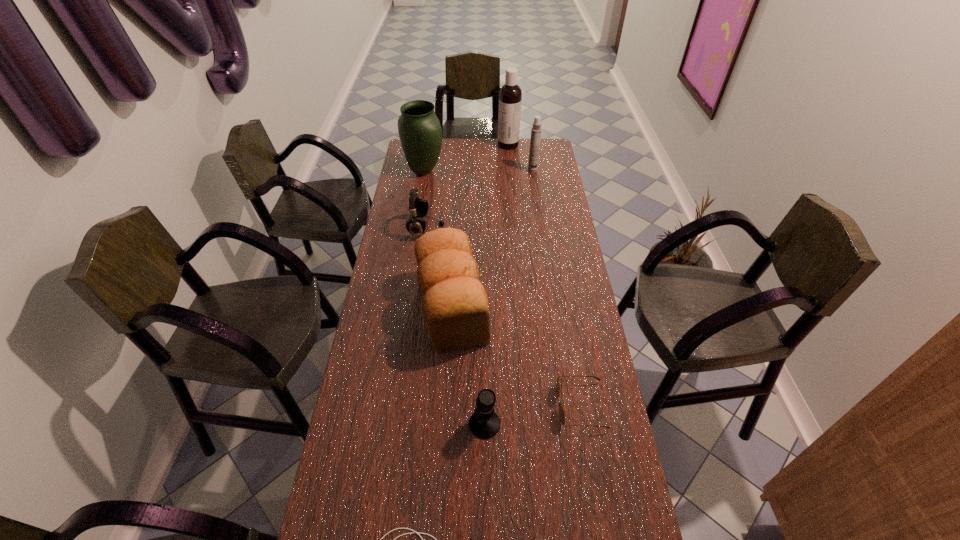
Identify the location of vase positioned at the far edge. (419, 129).

This screenshot has width=960, height=540. What are the coordinates of `vase positioned at the left edge` in the screenshot? It's located at (419, 129).

Where is `bread that is at the left edge`? This screenshot has height=540, width=960. bread that is at the left edge is located at coordinates (455, 304).

The image size is (960, 540). Find the location of `headset at the left edge`. headset at the left edge is located at coordinates (418, 208).

Find the location of a particular element. Image resolution: width=960 pixels, height=540 pixels. aerosol can located in the right edge section of the desktop is located at coordinates click(x=536, y=130).

The width and height of the screenshot is (960, 540). Find the location of `sunglasses located at the right edge`. sunglasses located at the right edge is located at coordinates (561, 410).

Find the location of `object at the far left corner`. object at the far left corner is located at coordinates (419, 129).

You are a GUI agent. You are given a task and a screenshot of the screen. Output one action in this format:
    pyautogui.click(x=<x>, y=<y>)
    Task: Click on the vacant space at the left edge of the desktop
    
    Given the screenshot: What is the action you would take?
    pyautogui.click(x=406, y=329)

In the image, there is a desktop. In order to click on vacant space at the right edge in this screenshot , I will do `click(633, 539)`.

Identify the location of free space between the farthest object and the aerosol can. (520, 158).